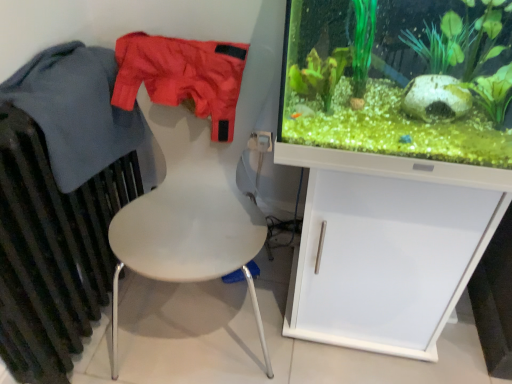
Question: From the image's perspective, is matte nylon shorts at upper left, which is the first clothing in right-to-left order, located above or below blue cotton jacket at left, the second clothing positioned from the right?

Choices:
 (A) below
 (B) above

Answer: (B)

Question: Choose the correct answer: Is matte nylon shorts at upper left, the second clothing in the left-to-right sequence, inside blue cotton jacket at left, which is counted as the first clothing, starting from the left, or outside it?

Choices:
 (A) outside
 (B) inside

Answer: (A)

Question: Estimate the real-world distances between objects in this image. Which object is closer to the green matte plant at right?

Choices:
 (A) white plastic chair at center
 (B) dark gray metallic radiator at left
 (C) blue cotton jacket at left, the second clothing positioned from the right
 (D) matte nylon shorts at upper left, the second clothing in the left-to-right sequence
 (E) white matte cabinet at right

Answer: (D)

Question: Based on their relative distances, which object is nearer to the dark gray metallic radiator at left?

Choices:
 (A) green matte plant at right
 (B) blue cotton jacket at left, the second clothing positioned from the right
 (C) white plastic chair at center
 (D) matte nylon shorts at upper left, the second clothing in the left-to-right sequence
 (E) white matte cabinet at right

Answer: (B)